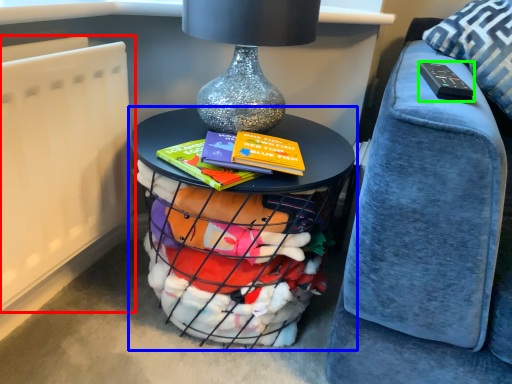
Question: Which object is positioned closest to radiator (highlighted by a red box)? Select from table (highlighted by a blue box) and remote (highlighted by a green box).

Choices:
 (A) table
 (B) remote

Answer: (A)